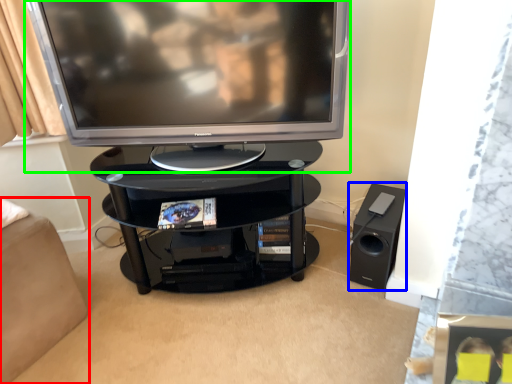
Question: Which object is positioned closest to furniture (highlighted by a red box)? Select from speaker (highlighted by a blue box) and television (highlighted by a green box).

Choices:
 (A) speaker
 (B) television

Answer: (B)